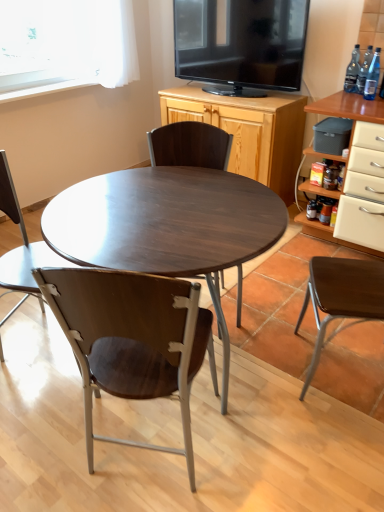
Find the location of a particular element. The width and height of the screenshot is (384, 512). free region under brown wood chair at right, arranged as the 1th chair when viewed from the right (from a real-world perspective) is located at coordinates (337, 360).